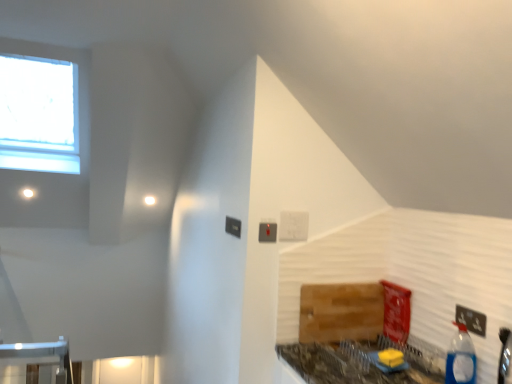
Question: Considering the relative sizes of blue plastic bottle at lower right and black plastic electric outlet at lower right in the image provided, is blue plastic bottle at lower right smaller than black plastic electric outlet at lower right?

Choices:
 (A) yes
 (B) no

Answer: (B)

Question: Is blue plastic bottle at lower right facing towards black plastic electric outlet at lower right?

Choices:
 (A) no
 (B) yes

Answer: (A)

Question: Considering the relative positions of blue plastic bottle at lower right and black plastic electric outlet at lower right in the image provided, is blue plastic bottle at lower right to the left of black plastic electric outlet at lower right from the viewer's perspective?

Choices:
 (A) no
 (B) yes

Answer: (B)

Question: Is black plastic electric outlet at lower right surrounded by blue plastic bottle at lower right?

Choices:
 (A) no
 (B) yes

Answer: (A)

Question: Does blue plastic bottle at lower right come behind black plastic electric outlet at lower right?

Choices:
 (A) no
 (B) yes

Answer: (A)

Question: Does point (335, 329) appear closer or farther from the camera than point (456, 306)?

Choices:
 (A) farther
 (B) closer

Answer: (A)

Question: In terms of height, does wooden cutting board at lower right look taller or shorter compared to black plastic electric outlet at lower right?

Choices:
 (A) short
 (B) tall

Answer: (B)

Question: Is wooden cutting board at lower right wider or thinner than black plastic electric outlet at lower right?

Choices:
 (A) thin
 (B) wide

Answer: (B)

Question: Considering the positions of wooden cutting board at lower right and black plastic electric outlet at lower right in the image, is wooden cutting board at lower right bigger or smaller than black plastic electric outlet at lower right?

Choices:
 (A) small
 (B) big

Answer: (B)

Question: Based on their sizes in the image, would you say marble-patterned countertop at lower right is bigger or smaller than black plastic electric outlet at lower right?

Choices:
 (A) small
 (B) big

Answer: (B)

Question: From a real-world perspective, relative to black plastic electric outlet at lower right, is marble-patterned countertop at lower right vertically above or below?

Choices:
 (A) above
 (B) below

Answer: (B)

Question: Based on their positions, is marble-patterned countertop at lower right located to the left or right of black plastic electric outlet at lower right?

Choices:
 (A) left
 (B) right

Answer: (A)

Question: Is point (373, 347) closer or farther from the camera than point (474, 317)?

Choices:
 (A) farther
 (B) closer

Answer: (A)

Question: Is point (471, 311) closer or farther from the camera than point (308, 334)?

Choices:
 (A) closer
 (B) farther

Answer: (A)

Question: Considering the positions of black plastic electric outlet at lower right and wooden cutting board at lower right in the image, is black plastic electric outlet at lower right bigger or smaller than wooden cutting board at lower right?

Choices:
 (A) small
 (B) big

Answer: (A)